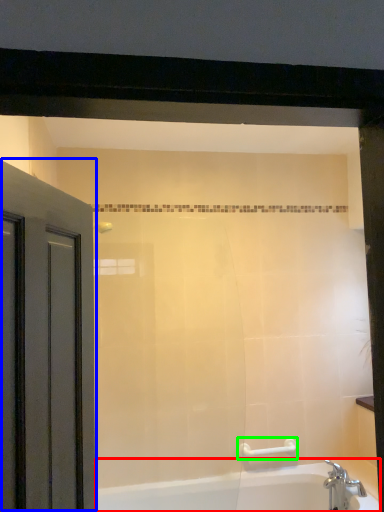
Question: Considering the real-world distances, which object is farthest from bathtub (highlighted by a red box)? door (highlighted by a blue box) or towel bar (highlighted by a green box)?

Choices:
 (A) door
 (B) towel bar

Answer: (A)